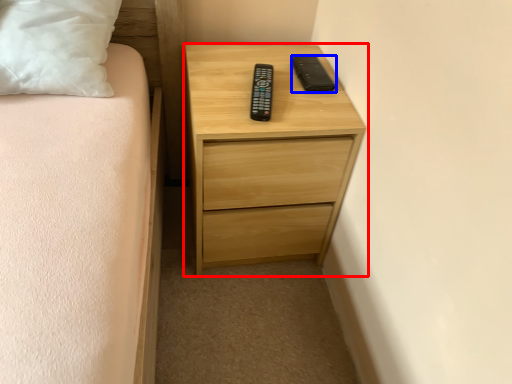
Question: Which object appears farthest to the camera in this image, chest of drawers (highlighted by a red box) or gadget (highlighted by a blue box)?

Choices:
 (A) chest of drawers
 (B) gadget

Answer: (B)